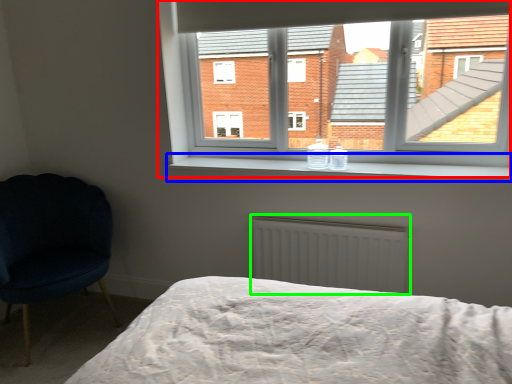
Question: Based on their relative distances, which object is farther from window (highlighted by a red box)? Choose from window sill (highlighted by a blue box) and radiator (highlighted by a green box).

Choices:
 (A) window sill
 (B) radiator

Answer: (B)